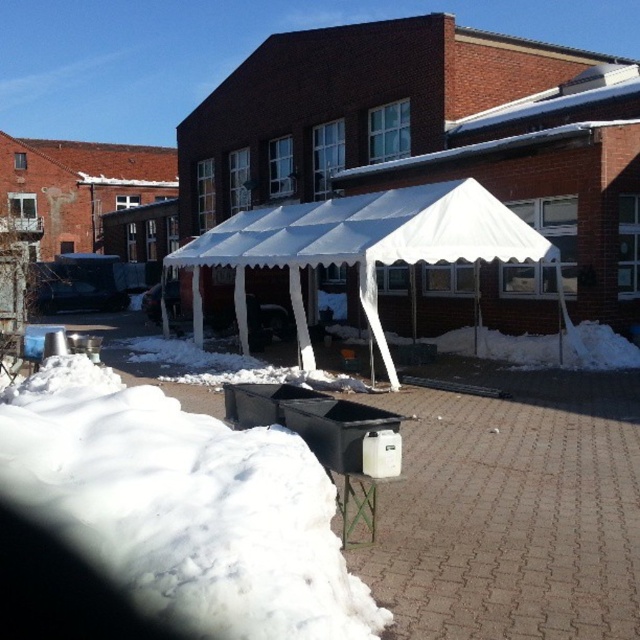
Question: Which of the following is the closest to the observer?

Choices:
 (A) white fluffy snow at lower left
 (B) white fabric canopy at center

Answer: (A)

Question: Which point is closer to the camera?

Choices:
 (A) (429, 212)
 (B) (195, 608)

Answer: (B)

Question: Is white fluffy snow at lower left below white fabric canopy at center?

Choices:
 (A) yes
 (B) no

Answer: (A)

Question: Does white fluffy snow at lower left appear on the right side of white fabric canopy at center?

Choices:
 (A) no
 (B) yes

Answer: (A)

Question: Where is white fluffy snow at lower left located in relation to white fabric canopy at center in the image?

Choices:
 (A) right
 (B) left

Answer: (B)